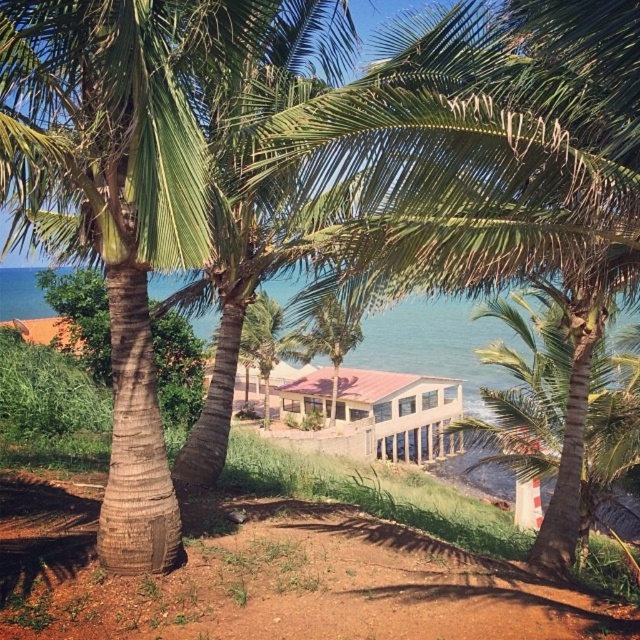
Is green leafy palm tree at center positioned behind pink corrugated metal hut at center?

No.

Between green leafy palm tree at center and pink corrugated metal hut at center, which one appears on the right side from the viewer's perspective?

From the viewer's perspective, green leafy palm tree at center appears more on the right side.

Which is behind, point (572, 420) or point (444, 401)?

The point (444, 401) is behind.

You are a GUI agent. You are given a task and a screenshot of the screen. Output one action in this format:
    pyautogui.click(x=<x>, y=<y>)
    Task: Click on the green leafy palm tree at center
    
    Given the screenshot: What is the action you would take?
    pyautogui.click(x=560, y=416)